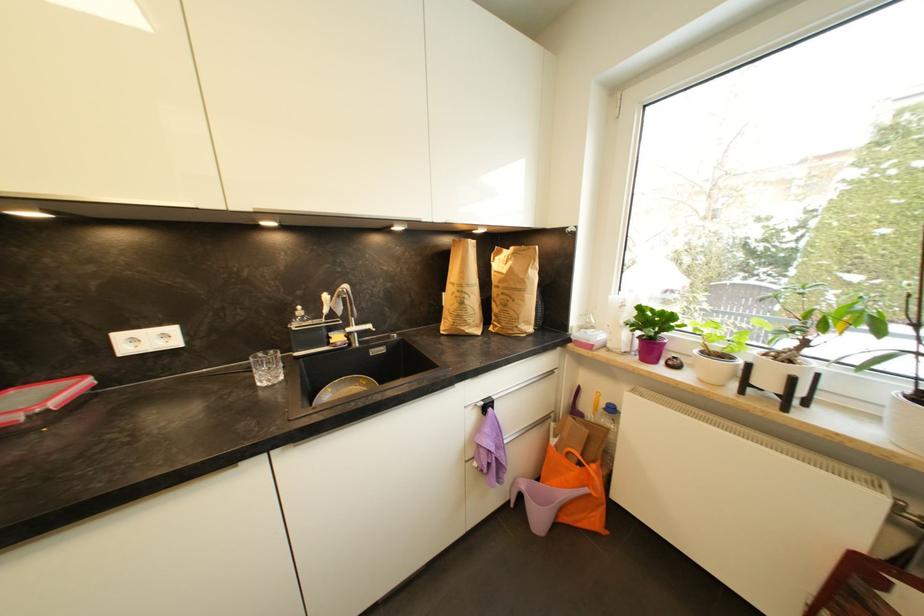
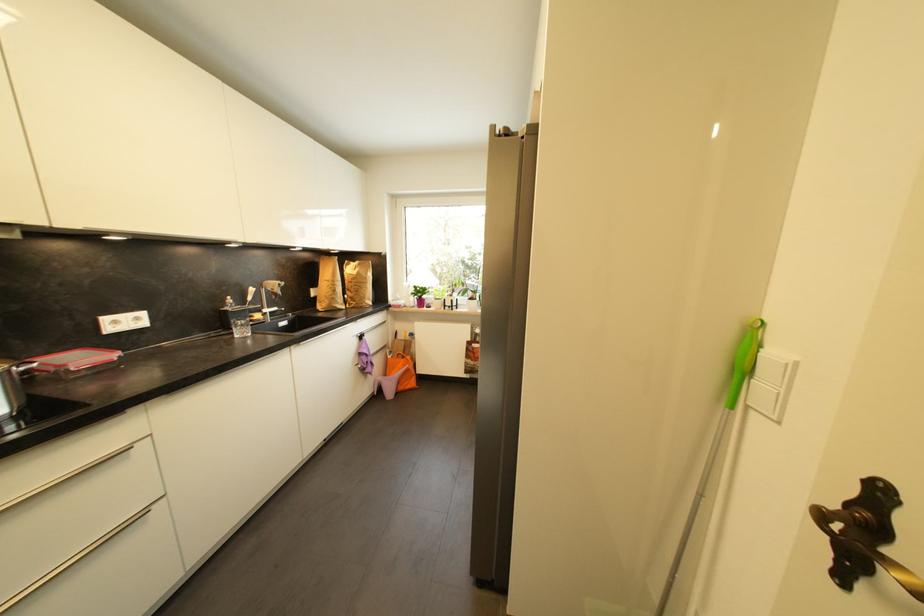
Locate, in the second image, the point that corresponds to point 557,443 in the first image.

(395, 359)